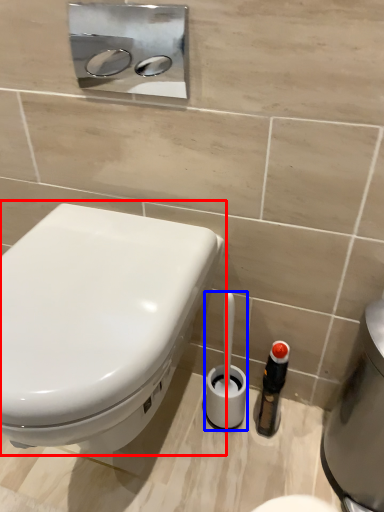
Question: Which object appears closest to the camera in this image, toilet (highlighted by a red box) or brush (highlighted by a blue box)?

Choices:
 (A) toilet
 (B) brush

Answer: (A)